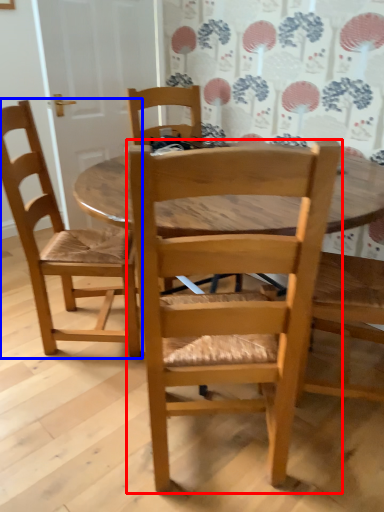
Question: Among these objects, which one is farthest to the camera, chair (highlighted by a red box) or chair (highlighted by a blue box)?

Choices:
 (A) chair
 (B) chair

Answer: (B)